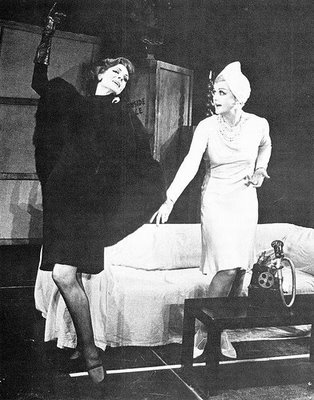
This screenshot has height=400, width=314. I want to click on telephone cord, so click(289, 260), click(286, 305).